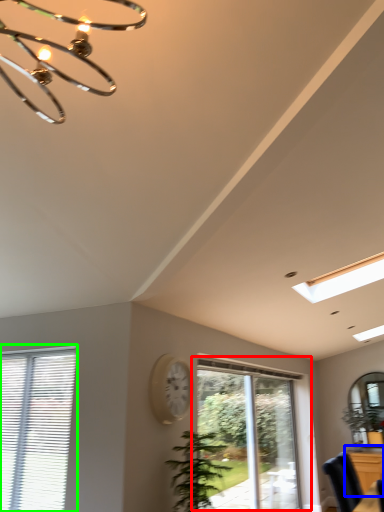
Question: Considering the real-world distances, which object is farthest from window (highlighted by a red box)? dresser (highlighted by a blue box) or window (highlighted by a green box)?

Choices:
 (A) dresser
 (B) window

Answer: (B)